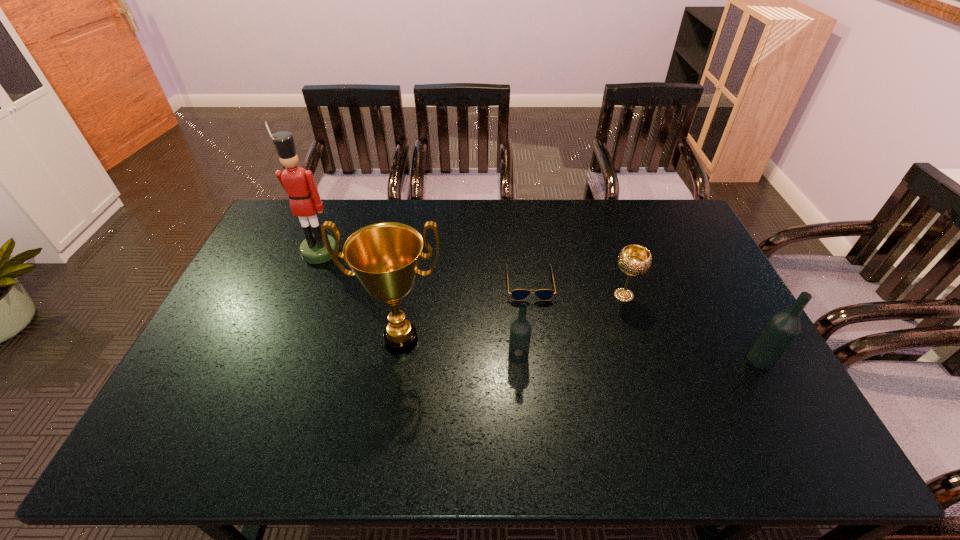
Identify the location of vacant place for an extra vodka on the left. This screenshot has width=960, height=540. (279, 352).